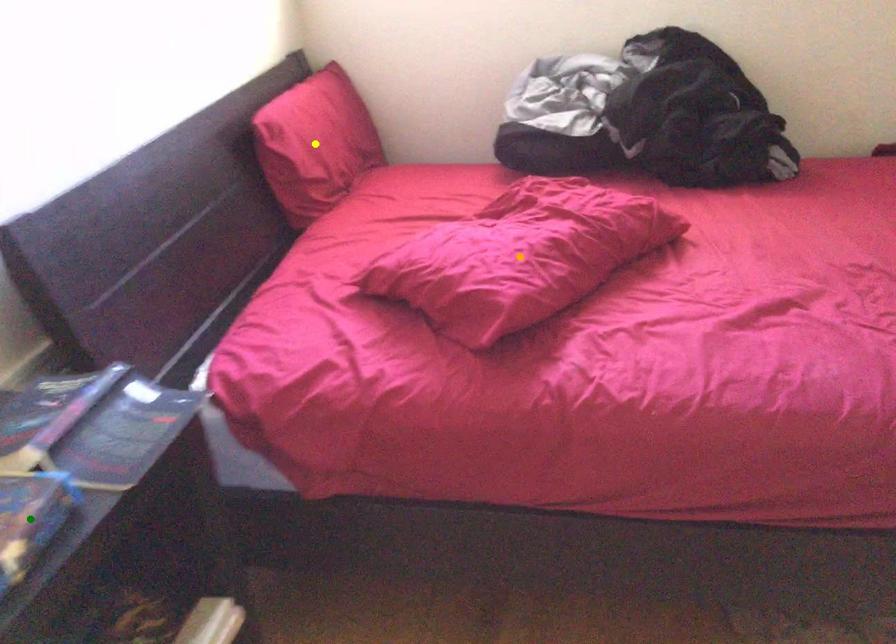
Order these from farthest to nearest:
A) orange point
B) yellow point
C) green point

yellow point
orange point
green point